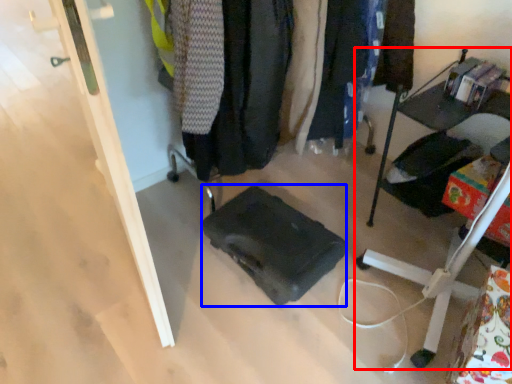
Question: Which object appears closest to the camera in this image, furniture (highlighted by a red box) or luggage (highlighted by a blue box)?

Choices:
 (A) furniture
 (B) luggage

Answer: (A)